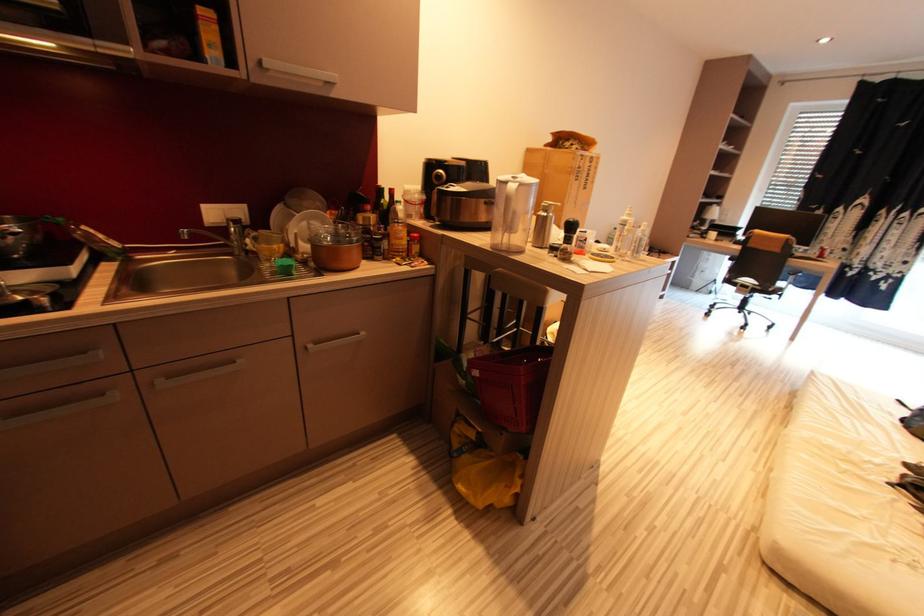
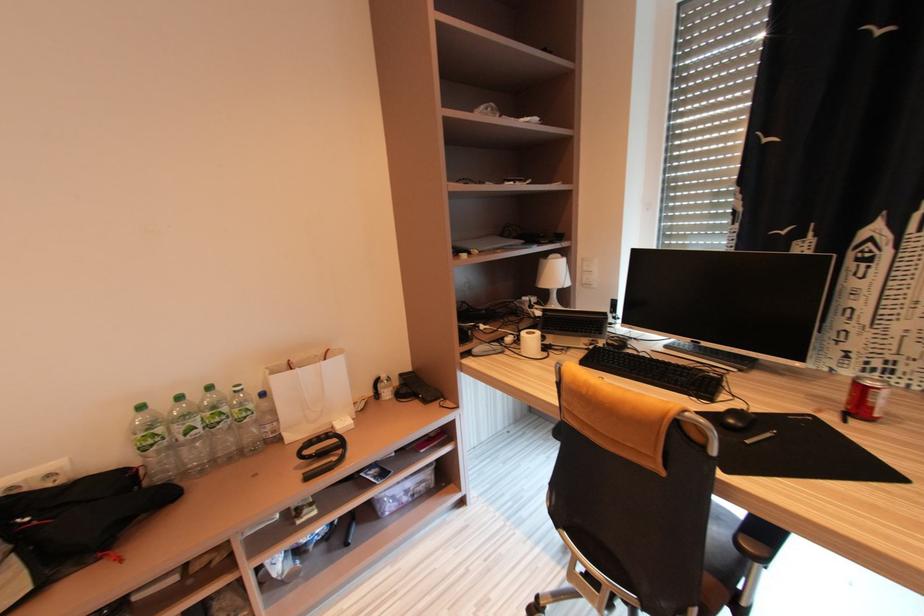
In a continuous first-person perspective shot, in which direction is the camera moving?

The cameraman walked toward right, forward.